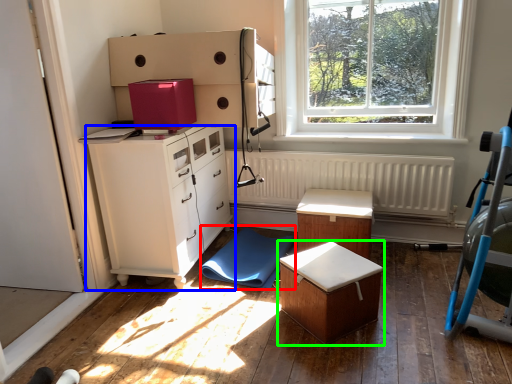
Question: Which is nearer to the swivel chair (highlighted by a red box)? chest of drawers (highlighted by a blue box) or table (highlighted by a green box).

Choices:
 (A) chest of drawers
 (B) table

Answer: (A)